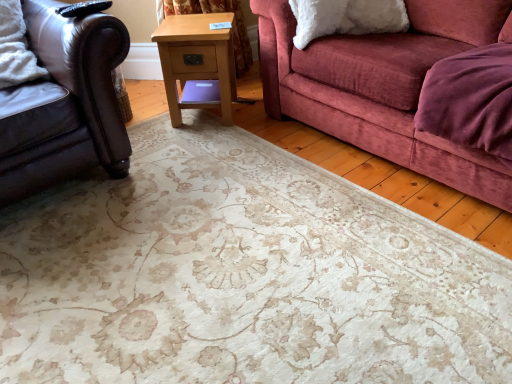
Question: Does leather couch at left appear on the right side of light wood/texture side table at center?

Choices:
 (A) no
 (B) yes

Answer: (A)

Question: Could you tell me if leather couch at left is facing light wood/texture side table at center?

Choices:
 (A) no
 (B) yes

Answer: (A)

Question: Can you confirm if leather couch at left is smaller than light wood/texture side table at center?

Choices:
 (A) yes
 (B) no

Answer: (B)

Question: Is leather couch at left next to light wood/texture side table at center and touching it?

Choices:
 (A) yes
 (B) no

Answer: (B)

Question: Considering the relative sizes of leather couch at left and light wood/texture side table at center in the image provided, is leather couch at left shorter than light wood/texture side table at center?

Choices:
 (A) no
 (B) yes

Answer: (A)

Question: Would you say light wood/texture side table at center is part of leather couch at left's contents?

Choices:
 (A) yes
 (B) no

Answer: (B)

Question: Could you tell me if light wood/texture side table at center is turned towards leather couch at left?

Choices:
 (A) no
 (B) yes

Answer: (A)

Question: Considering the relative sizes of light wood/texture side table at center and leather couch at left in the image provided, is light wood/texture side table at center smaller than leather couch at left?

Choices:
 (A) no
 (B) yes

Answer: (B)

Question: Is light wood/texture side table at center closer to camera compared to leather couch at left?

Choices:
 (A) no
 (B) yes

Answer: (A)

Question: Considering the relative positions of light wood/texture side table at center and leather couch at left in the image provided, is light wood/texture side table at center to the left of leather couch at left from the viewer's perspective?

Choices:
 (A) no
 (B) yes

Answer: (A)

Question: Does light wood/texture side table at center have a lesser height compared to leather couch at left?

Choices:
 (A) no
 (B) yes

Answer: (B)

Question: Are light wood/texture side table at center and leather couch at left beside each other?

Choices:
 (A) no
 (B) yes

Answer: (A)

Question: Relative to leather couch at left, is light wood/texture side table at center in front or behind?

Choices:
 (A) front
 (B) behind

Answer: (B)